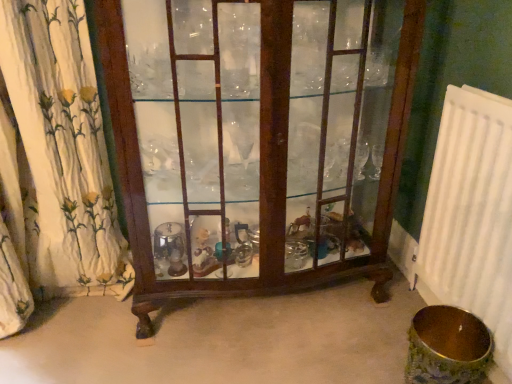
Question: Is white floral fabric at left taller than white plastic radiator at right?

Choices:
 (A) yes
 (B) no

Answer: (A)

Question: From a real-world perspective, is white floral fabric at left physically above white plastic radiator at right?

Choices:
 (A) no
 (B) yes

Answer: (B)

Question: Considering the relative sizes of white floral fabric at left and white plastic radiator at right in the image provided, is white floral fabric at left smaller than white plastic radiator at right?

Choices:
 (A) no
 (B) yes

Answer: (A)

Question: Is white floral fabric at left completely or partially outside of white plastic radiator at right?

Choices:
 (A) no
 (B) yes

Answer: (B)

Question: Does white floral fabric at left turn towards white plastic radiator at right?

Choices:
 (A) no
 (B) yes

Answer: (A)

Question: Is mahogany glass cabinet at center in front of or behind white floral fabric at left in the image?

Choices:
 (A) front
 (B) behind

Answer: (A)

Question: In terms of width, does mahogany glass cabinet at center look wider or thinner when compared to white floral fabric at left?

Choices:
 (A) thin
 (B) wide

Answer: (B)

Question: In terms of size, does mahogany glass cabinet at center appear bigger or smaller than white floral fabric at left?

Choices:
 (A) big
 (B) small

Answer: (A)

Question: Considering the relative positions of mahogany glass cabinet at center and white floral fabric at left in the image provided, is mahogany glass cabinet at center to the left or to the right of white floral fabric at left?

Choices:
 (A) left
 (B) right

Answer: (B)

Question: In terms of size, does white floral fabric at left appear bigger or smaller than white plastic radiator at right?

Choices:
 (A) big
 (B) small

Answer: (A)

Question: From their relative heights in the image, would you say white floral fabric at left is taller or shorter than white plastic radiator at right?

Choices:
 (A) short
 (B) tall

Answer: (B)

Question: From a real-world perspective, is white floral fabric at left physically located above or below white plastic radiator at right?

Choices:
 (A) below
 (B) above

Answer: (B)

Question: From the image's perspective, is white floral fabric at left located above or below white plastic radiator at right?

Choices:
 (A) below
 (B) above

Answer: (B)

Question: From the image's perspective, relative to mahogany glass cabinet at center, is white floral fabric at left above or below?

Choices:
 (A) below
 (B) above

Answer: (A)

Question: Visually, is white floral fabric at left positioned to the left or to the right of mahogany glass cabinet at center?

Choices:
 (A) right
 (B) left

Answer: (B)